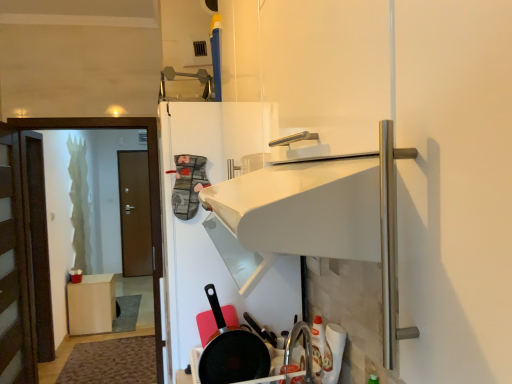
Question: From the image's perspective, is brown wooden door at left, the second door when ordered from front to back, on matte brown screen door at left?

Choices:
 (A) no
 (B) yes

Answer: (B)

Question: Is there a large distance between brown wooden door at left, acting as the first door starting from the back, and matte brown screen door at left?

Choices:
 (A) no
 (B) yes

Answer: (B)

Question: Is brown wooden door at left, the second door when ordered from front to back, not inside matte brown screen door at left?

Choices:
 (A) yes
 (B) no

Answer: (A)

Question: Is brown wooden door at left, the second door when ordered from front to back, to the left of matte brown screen door at left from the viewer's perspective?

Choices:
 (A) no
 (B) yes

Answer: (B)

Question: Considering the relative sizes of brown wooden door at left, the second door when ordered from front to back, and matte brown screen door at left in the image provided, is brown wooden door at left, the second door when ordered from front to back, smaller than matte brown screen door at left?

Choices:
 (A) no
 (B) yes

Answer: (B)

Question: Could you tell me if brown wooden door at left, the second door when ordered from front to back, is turned towards matte brown screen door at left?

Choices:
 (A) no
 (B) yes

Answer: (B)

Question: Considering the relative sizes of matte wood cabinet at lower left and brown wooden door at left, acting as the first door starting from the back, in the image provided, is matte wood cabinet at lower left taller than brown wooden door at left, acting as the first door starting from the back,?

Choices:
 (A) yes
 (B) no

Answer: (B)

Question: Considering the relative sizes of matte wood cabinet at lower left and brown wooden door at left, the second door when ordered from front to back, in the image provided, is matte wood cabinet at lower left smaller than brown wooden door at left, the second door when ordered from front to back,?

Choices:
 (A) no
 (B) yes

Answer: (B)

Question: From the image's perspective, does matte wood cabinet at lower left appear lower than brown wooden door at left, the second door when ordered from front to back?

Choices:
 (A) no
 (B) yes

Answer: (B)

Question: Are matte wood cabinet at lower left and brown wooden door at left, the second door when ordered from front to back, located far from each other?

Choices:
 (A) no
 (B) yes

Answer: (B)

Question: From the image's perspective, would you say matte wood cabinet at lower left is positioned over brown wooden door at left, the second door when ordered from front to back?

Choices:
 (A) no
 (B) yes

Answer: (A)

Question: Is matte wood cabinet at lower left bigger than brown wooden door at left, the second door when ordered from front to back?

Choices:
 (A) no
 (B) yes

Answer: (A)

Question: Is brown wooden door at left, the 1th door in the front-to-back sequence, at the right side of brown wooden door at left, the second door when ordered from front to back?

Choices:
 (A) yes
 (B) no

Answer: (A)